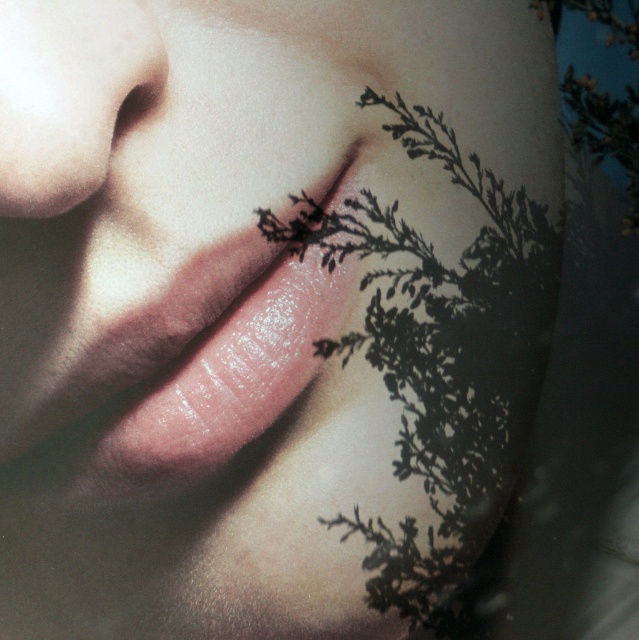
Question: Estimate the real-world distances between objects in this image. Which object is closer to the smooth skin nose at upper left?

Choices:
 (A) glossy pink lips at center
 (B) black matte plant at lower right

Answer: (A)

Question: Can you confirm if glossy pink lips at center is positioned to the left of smooth skin nose at upper left?

Choices:
 (A) yes
 (B) no

Answer: (B)

Question: Which object is the farthest from the black matte plant at lower right?

Choices:
 (A) smooth skin nose at upper left
 (B) glossy pink lips at center

Answer: (A)

Question: Does black matte plant at lower right appear over smooth skin nose at upper left?

Choices:
 (A) no
 (B) yes

Answer: (A)

Question: Which object is farther from the camera taking this photo?

Choices:
 (A) black matte plant at lower right
 (B) glossy pink lips at center

Answer: (A)

Question: Can you confirm if black matte plant at lower right is wider than glossy pink lips at center?

Choices:
 (A) yes
 (B) no

Answer: (A)